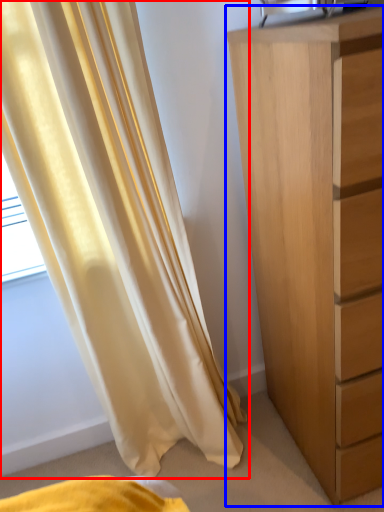
Question: Which of the following is the farthest to the observer, curtain (highlighted by a red box) or chest of drawers (highlighted by a blue box)?

Choices:
 (A) curtain
 (B) chest of drawers

Answer: (A)